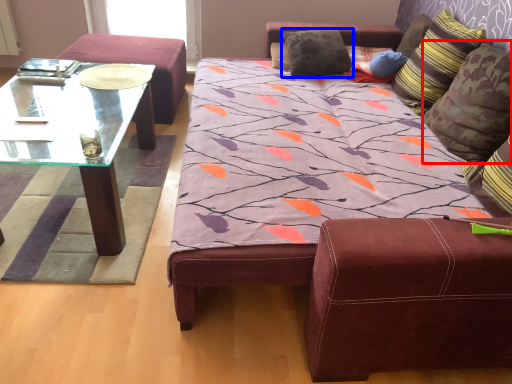
Question: Which point is closer to the camera, pillow (highlighted by a red box) or pillow (highlighted by a blue box)?

Choices:
 (A) pillow
 (B) pillow

Answer: (A)